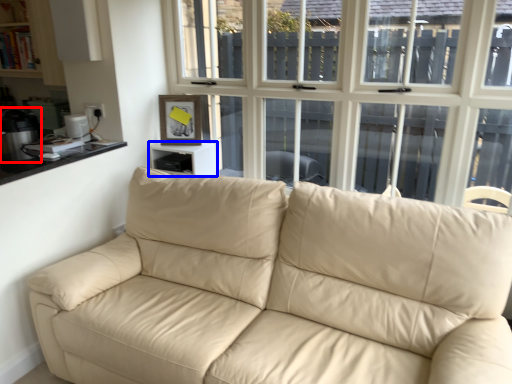
Question: Which object is closer to the camera taking this photo, appliance (highlighted by a red box) or table (highlighted by a blue box)?

Choices:
 (A) appliance
 (B) table

Answer: (A)